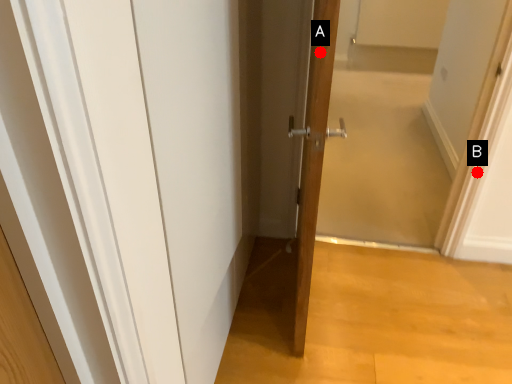
Question: Two points are circled on the image, labeled by A and B beside each circle. Among these points, which one is nearest to the camera?

Choices:
 (A) A is closer
 (B) B is closer

Answer: (A)